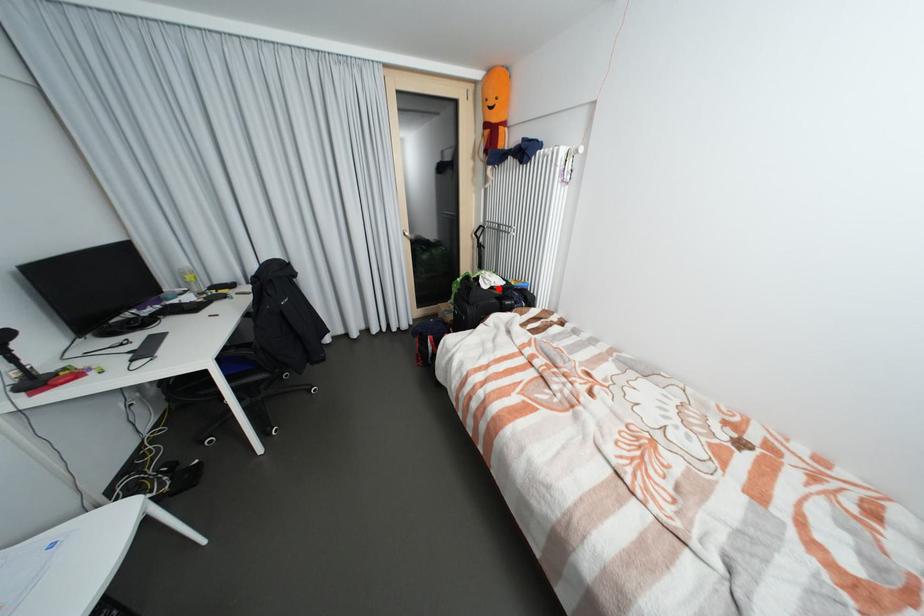
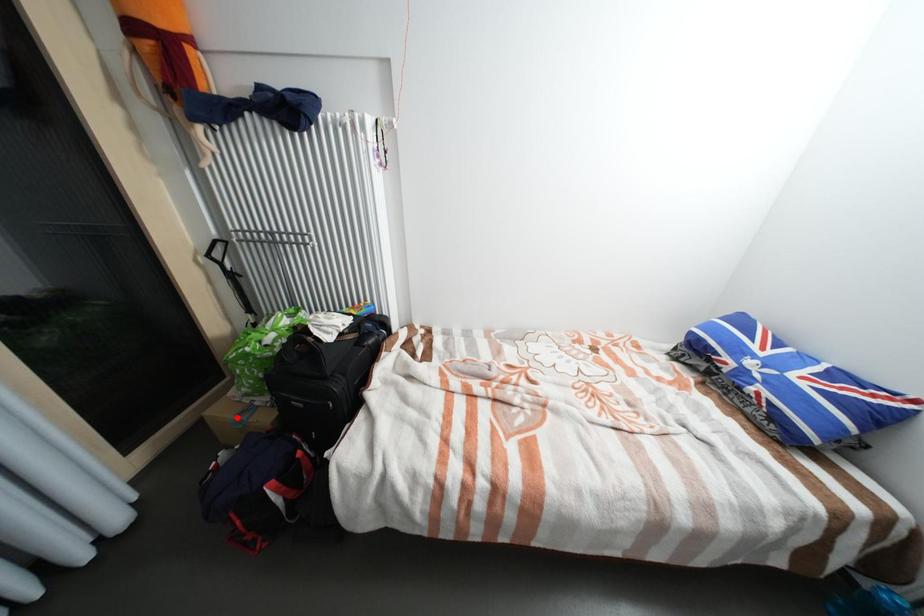
I am providing you with two images of the same scene from different viewpoints. A red point is marked on the first image and another point is marked on the second image. Do the highlighted points in image1 and image2 indicate the same real-world spot?

No